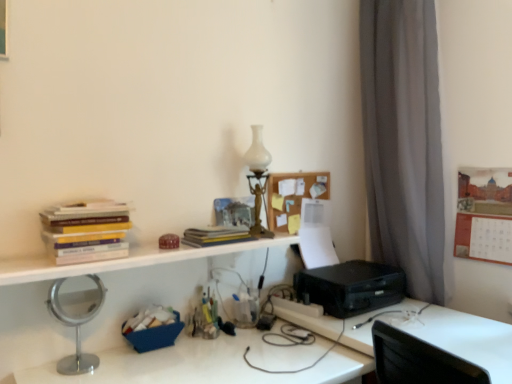
At what (x,y) coordinates should I click in order to perform the action: click on space that is in front of blue fabric basket at lower left, which is counted as the first stationery, starting from the bottom. Please return your answer as a coordinate pair (x, y). Image resolution: width=512 pixels, height=384 pixels. Looking at the image, I should click on (166, 367).